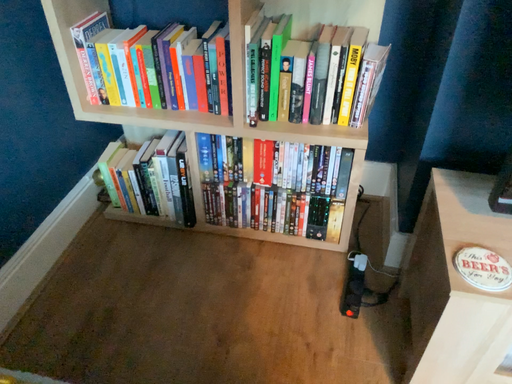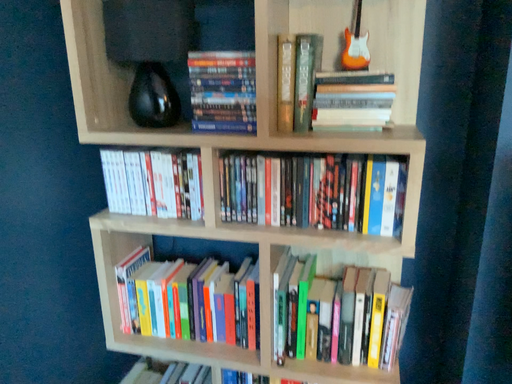
Question: How did the camera likely rotate when shooting the video?

Choices:
 (A) rotated upward
 (B) rotated downward

Answer: (A)